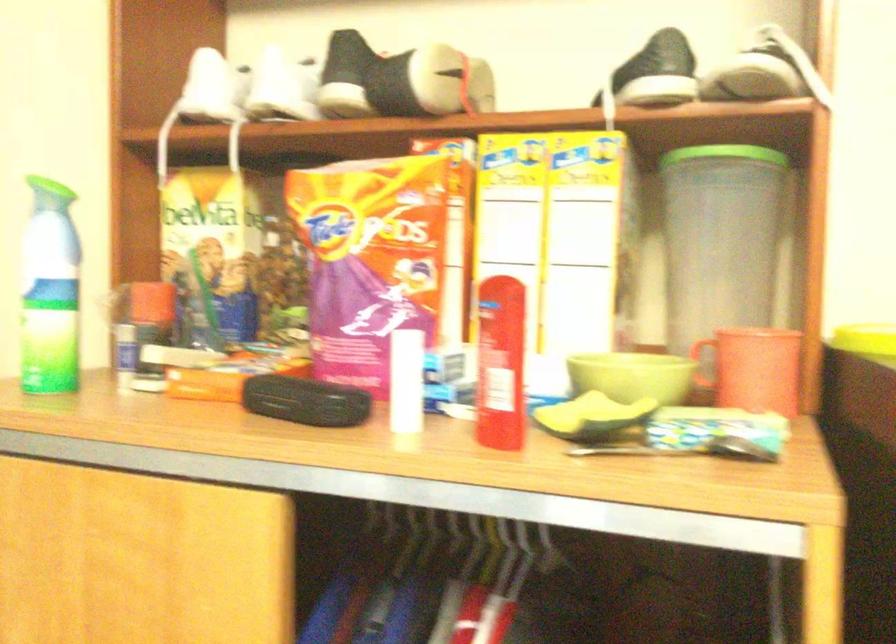
I want to click on white lip balm, so click(407, 386).